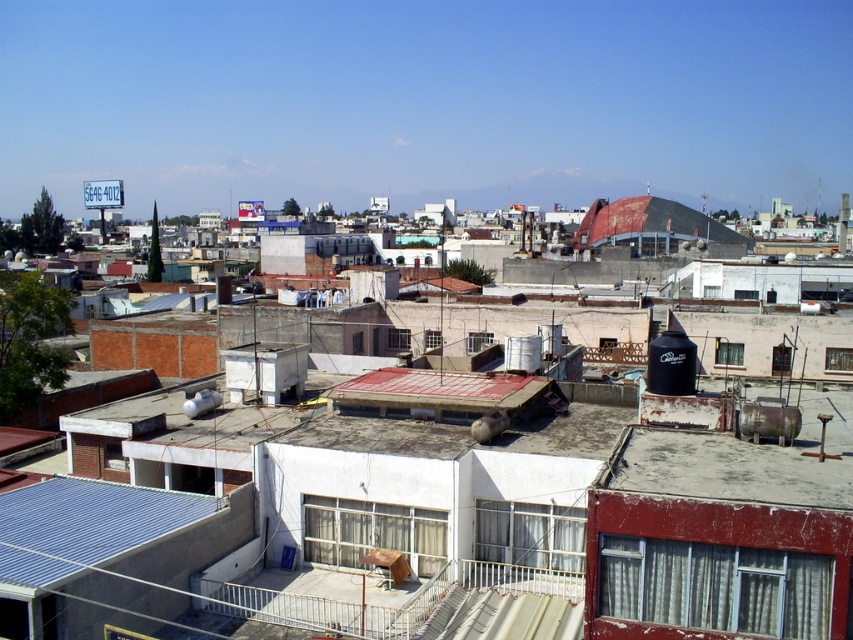
Can you confirm if red matte roof at center is wider than rusty corrugated metal roof at center?

No, red matte roof at center is not wider than rusty corrugated metal roof at center.

Find the location of `red matte roof at center`. red matte roof at center is located at coordinates (436, 392).

Is point (378, 371) behind point (602, 241)?

No, it is in front of (602, 241).

You are a GUI agent. You are given a task and a screenshot of the screen. Output one action in this format:
    pyautogui.click(x=<x>, y=<y>)
    Task: Click on the red matte roof at center
    The width and height of the screenshot is (853, 640).
    Given the screenshot: What is the action you would take?
    click(x=436, y=392)